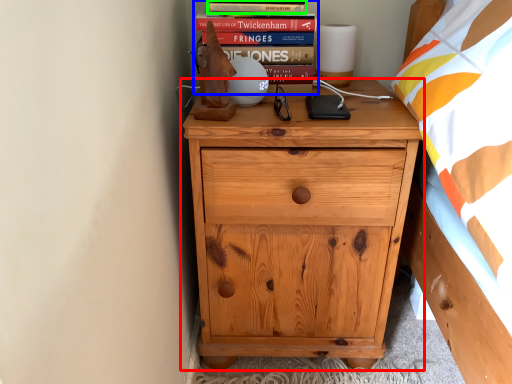
Question: Which object is the farthest from chest of drawers (highlighted by a red box)? Choose among these: book (highlighted by a blue box) or paperback book (highlighted by a green box).

Choices:
 (A) book
 (B) paperback book

Answer: (B)